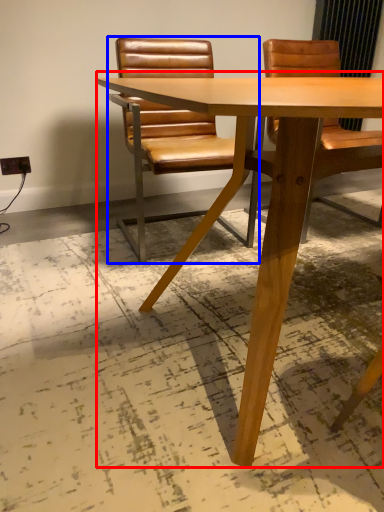
Question: Which object appears closest to the camera in this image, table (highlighted by a red box) or chair (highlighted by a blue box)?

Choices:
 (A) table
 (B) chair

Answer: (A)